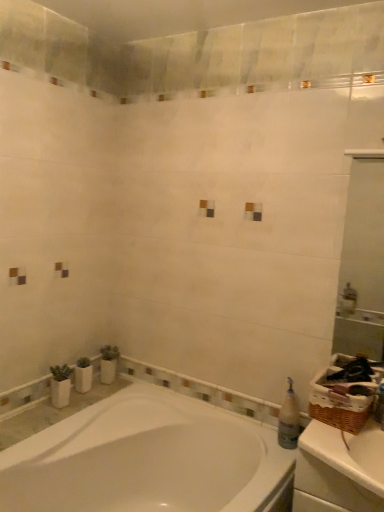
Question: From the image's perspective, relative to translucent plastic bottle at right, is white glossy mirror at upper right above or below?

Choices:
 (A) above
 (B) below

Answer: (A)

Question: Looking at their shapes, would you say white glossy mirror at upper right is wider or thinner than translucent plastic bottle at right?

Choices:
 (A) wide
 (B) thin

Answer: (B)

Question: Estimate the real-world distances between objects in this image. Which object is farther from the white glossy bathtub at lower left?

Choices:
 (A) white glossy mirror at upper right
 (B) translucent plastic bottle at right
 (C) white matte counter top at right

Answer: (A)

Question: Considering the real-world distances, which object is farthest from the translucent plastic bottle at right?

Choices:
 (A) white glossy bathtub at lower left
 (B) white matte counter top at right
 (C) white glossy mirror at upper right

Answer: (C)